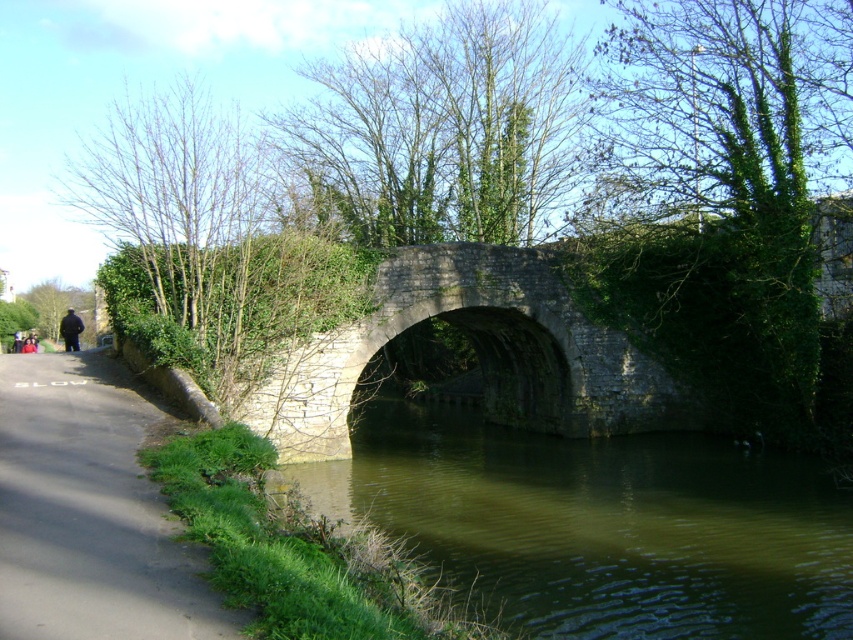
Is the position of gray asphalt road at lower left less distant than that of dark gray fabric jacket at left?

Yes, gray asphalt road at lower left is closer to the viewer.

Is point (67, 456) behind point (67, 339)?

No, it is in front of (67, 339).

Where is `gray asphalt road at lower left`? This screenshot has height=640, width=853. gray asphalt road at lower left is located at coordinates (91, 509).

Which is behind, point (627, 520) or point (427, 280)?

Point (427, 280)

Is greenish murky water at center further to the viewer compared to gray stone bridge at center?

No, it is in front of gray stone bridge at center.

I want to click on greenish murky water at center, so click(x=602, y=525).

Between gray stone bridge at center and dark gray fabric jacket at left, which one has less height?

Standing shorter between the two is dark gray fabric jacket at left.

Locate an element on the screen. gray stone bridge at center is located at coordinates (477, 355).

Locate an element on the screen. The height and width of the screenshot is (640, 853). gray stone bridge at center is located at coordinates (477, 355).